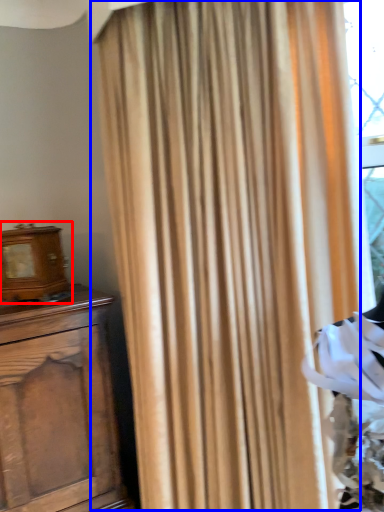
Question: Which object is closer to the camera taking this photo, alarm clock (highlighted by a red box) or curtain (highlighted by a blue box)?

Choices:
 (A) alarm clock
 (B) curtain

Answer: (B)